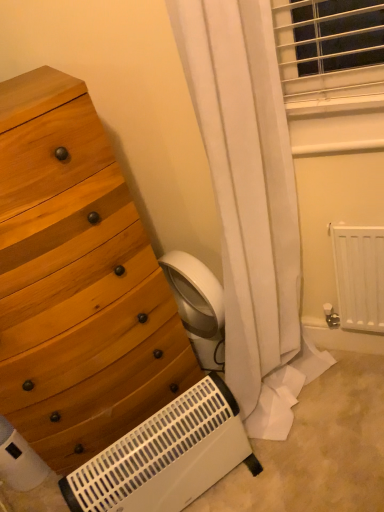
Question: Would you say white matte radiator at lower right is part of white plastic heater at lower center's contents?

Choices:
 (A) yes
 (B) no

Answer: (B)

Question: Can you confirm if white plastic heater at lower center is positioned to the left of white matte radiator at lower right?

Choices:
 (A) no
 (B) yes

Answer: (B)

Question: Is white plastic heater at lower center to the right of white matte radiator at lower right from the viewer's perspective?

Choices:
 (A) no
 (B) yes

Answer: (A)

Question: Does white plastic heater at lower center come in front of white matte radiator at lower right?

Choices:
 (A) no
 (B) yes

Answer: (B)

Question: Is white plastic heater at lower center further to camera compared to white matte radiator at lower right?

Choices:
 (A) yes
 (B) no

Answer: (B)

Question: Is white plastic heater at lower center smaller than white matte radiator at lower right?

Choices:
 (A) no
 (B) yes

Answer: (A)

Question: From a real-world perspective, does wooden chest of drawers at left sit lower than white plastic heater at lower center?

Choices:
 (A) no
 (B) yes

Answer: (A)

Question: Is white plastic heater at lower center inside wooden chest of drawers at left?

Choices:
 (A) no
 (B) yes

Answer: (A)

Question: Is wooden chest of drawers at left facing towards white plastic heater at lower center?

Choices:
 (A) no
 (B) yes

Answer: (B)

Question: Considering the relative sizes of wooden chest of drawers at left and white plastic heater at lower center in the image provided, is wooden chest of drawers at left wider than white plastic heater at lower center?

Choices:
 (A) yes
 (B) no

Answer: (A)

Question: From the image's perspective, would you say wooden chest of drawers at left is shown under white plastic heater at lower center?

Choices:
 (A) yes
 (B) no

Answer: (B)

Question: Is wooden chest of drawers at left smaller than white plastic heater at lower center?

Choices:
 (A) yes
 (B) no

Answer: (B)

Question: Does wooden chest of drawers at left have a lesser height compared to white matte radiator at lower right?

Choices:
 (A) no
 (B) yes

Answer: (A)